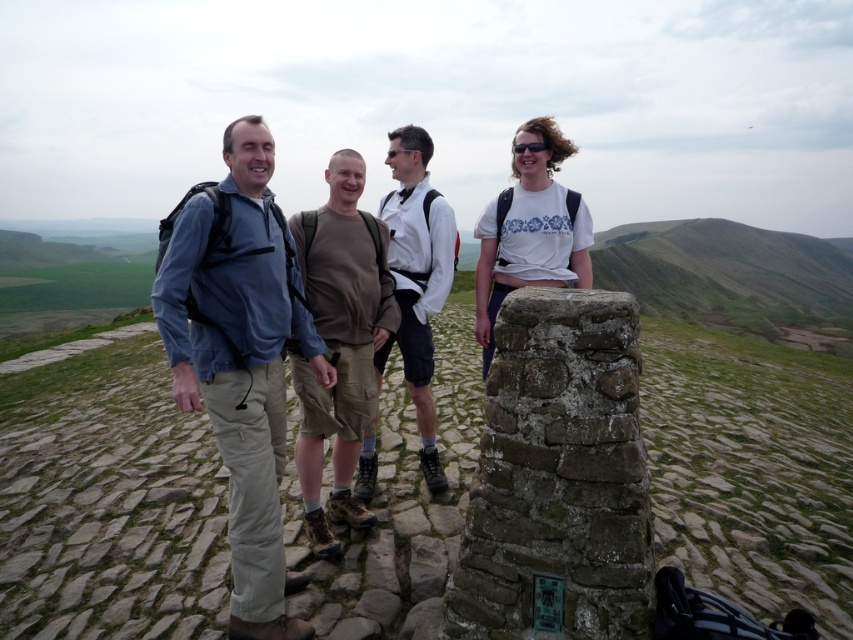
You are a photographer trying to capture a group photo of the matte blue shirt at center and the brown cotton shirt at center. If you want to ensure both shirts are fully visible in the frame, which shirt should you position closer to the camera to avoid overlapping?

The matte blue shirt at center might be wider than brown cotton shirt at center, so positioning the matte blue shirt at center closer to the camera would help ensure both shirts are fully visible without overlapping.

You are a photographer trying to capture a group photo of the matte blue shirt at center and the brown cotton shorts at center. The camera you have can only focus on objects within a 4 feet range. Will both subjects be in focus?

The matte blue shirt at center is 4.38 feet from the brown cotton shorts at center. Since the camera can only focus within a 4 feet range, the distance between them exceeds the focus range. Therefore, both subjects may not be in focus simultaneously.